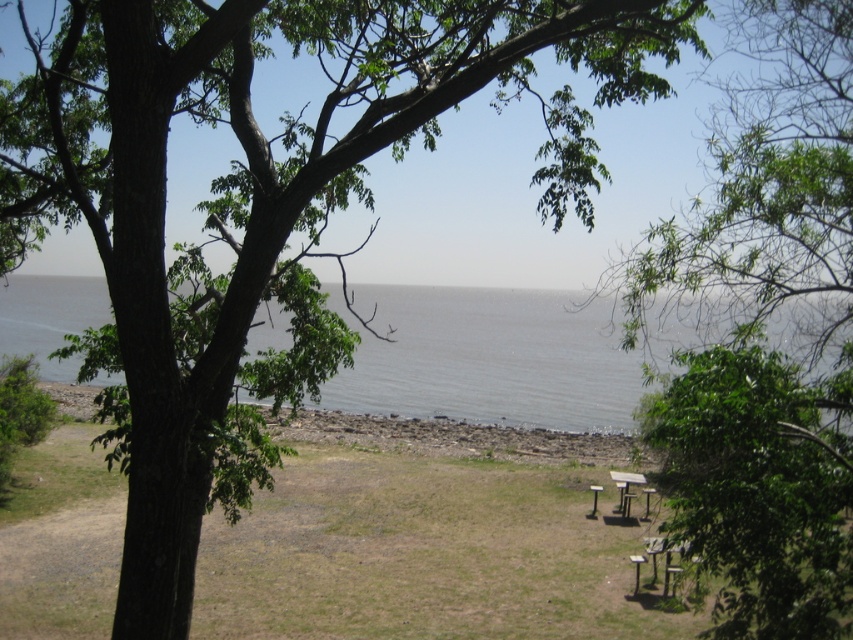
Question: Observing the image, what is the correct spatial positioning of green leafy tree at upper center in reference to brown wooden table at lower right?

Choices:
 (A) below
 (B) above

Answer: (B)

Question: Can you confirm if green leafy tree at upper center is wider than gray water at center?

Choices:
 (A) no
 (B) yes

Answer: (A)

Question: Which object is closer to the camera taking this photo?

Choices:
 (A) brown wooden table at lower right
 (B) green leafy tree at upper center
 (C) gray water at center

Answer: (B)

Question: Which of the following is the closest to the observer?

Choices:
 (A) brown wooden table at lower right
 (B) green leafy tree at upper center

Answer: (B)

Question: Is gray water at center bigger than brown wooden table at lower right?

Choices:
 (A) no
 (B) yes

Answer: (B)

Question: Considering the real-world distances, which object is closest to the green leafy tree at upper center?

Choices:
 (A) gray water at center
 (B) brown wooden table at lower right

Answer: (A)